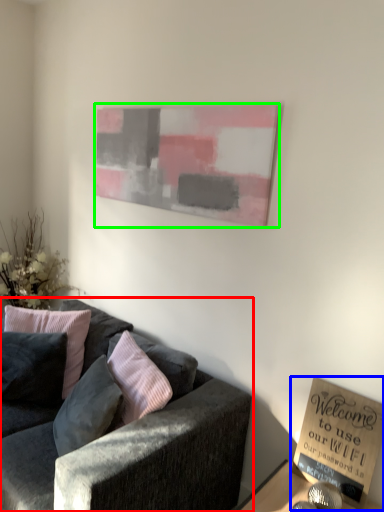
Question: Which object is positioned closest to studio couch (highlighted by a red box)? Select from book (highlighted by a blue box) and picture frame (highlighted by a green box).

Choices:
 (A) book
 (B) picture frame

Answer: (A)